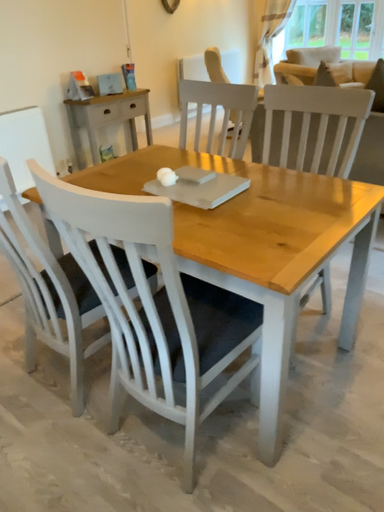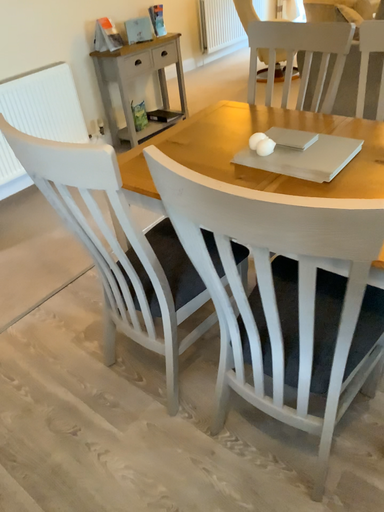
Question: Which way did the camera rotate in the video?

Choices:
 (A) rotated downward
 (B) rotated upward

Answer: (A)